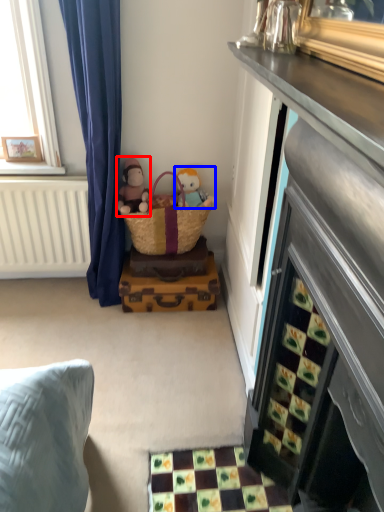
Question: Among these objects, which one is nearest to the camera, doll (highlighted by a red box) or toy (highlighted by a blue box)?

Choices:
 (A) doll
 (B) toy

Answer: (A)